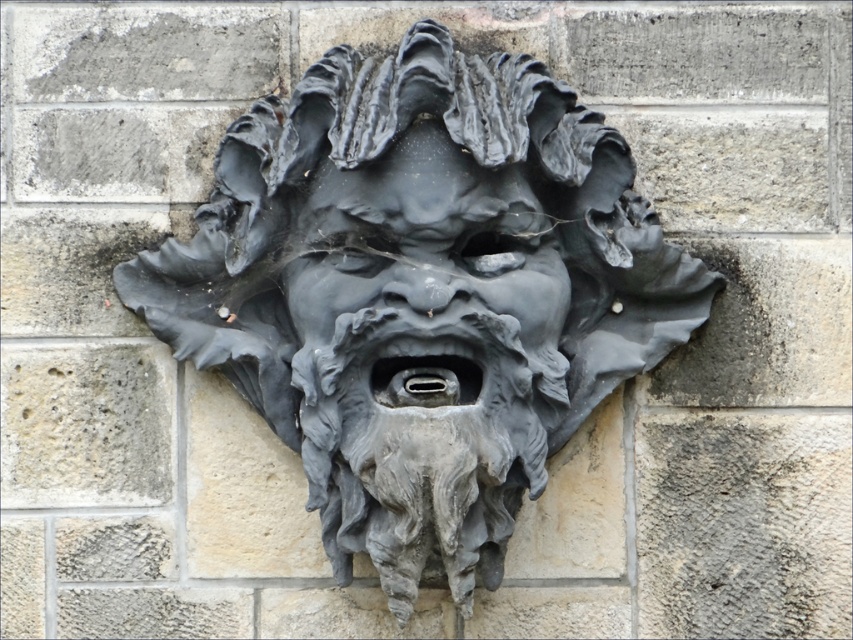
Question: Observing the image, what is the correct spatial positioning of matte gray stone mask at center in reference to matte gray stone face at center?

Choices:
 (A) above
 (B) below

Answer: (B)

Question: From the image, what is the correct spatial relationship of matte gray stone mask at center in relation to matte gray stone face at center?

Choices:
 (A) right
 (B) left

Answer: (A)

Question: Which point is closer to the camera taking this photo?

Choices:
 (A) (344, 380)
 (B) (553, 282)

Answer: (A)

Question: Among these points, which one is nearest to the camera?

Choices:
 (A) (498, 172)
 (B) (322, 80)

Answer: (A)

Question: In this image, where is matte gray stone mask at center located relative to matte gray stone face at center?

Choices:
 (A) above
 (B) below

Answer: (B)

Question: Among these objects, which one is nearest to the camera?

Choices:
 (A) matte gray stone mask at center
 (B) matte gray stone face at center

Answer: (A)